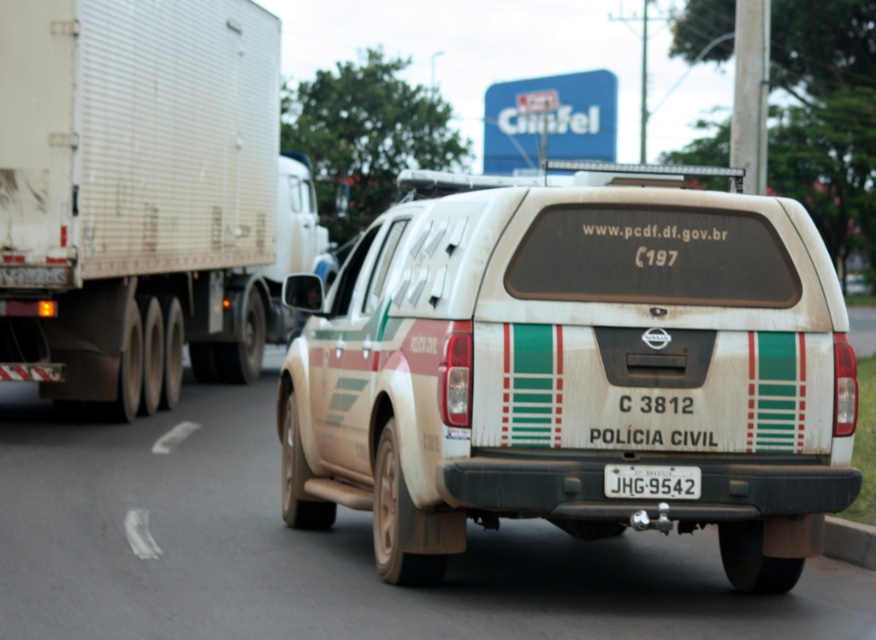
Which of these two, matte white truck at left or white plastic license plate at center, stands taller?

matte white truck at left

Locate an element on the screen. matte white truck at left is located at coordinates (260, 285).

Does point (258, 237) come farther from viewer compared to point (693, 488)?

Yes, it is behind point (693, 488).

Identify the location of matte white truck at left. coord(260,285).

Is point (599, 372) farther from camera compared to point (73, 179)?

No, (599, 372) is closer to viewer.

Is matte beige pickup truck at center positioned before white corrugated metal trailer truck at left?

Yes, it is in front of white corrugated metal trailer truck at left.

Identify the location of matte beige pickup truck at center. This screenshot has width=876, height=640. (573, 371).

Who is shorter, matte beige pickup truck at center or matte white truck at left?

Standing shorter between the two is matte white truck at left.

Does matte beige pickup truck at center have a lesser height compared to matte white truck at left?

No, matte beige pickup truck at center is not shorter than matte white truck at left.

Who is more distant from viewer, (x=489, y=337) or (x=219, y=337)?

Point (x=219, y=337)

I want to click on matte beige pickup truck at center, so click(x=573, y=371).